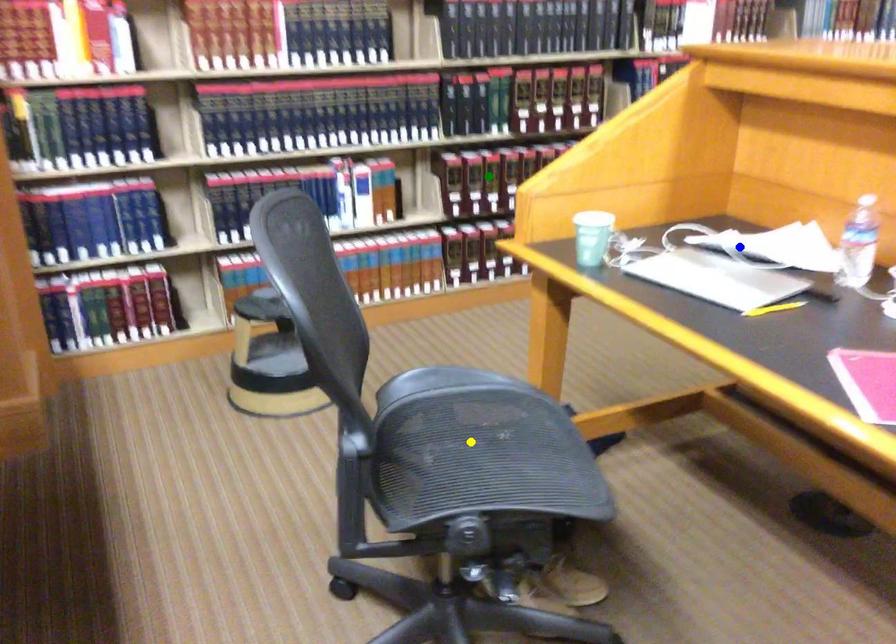
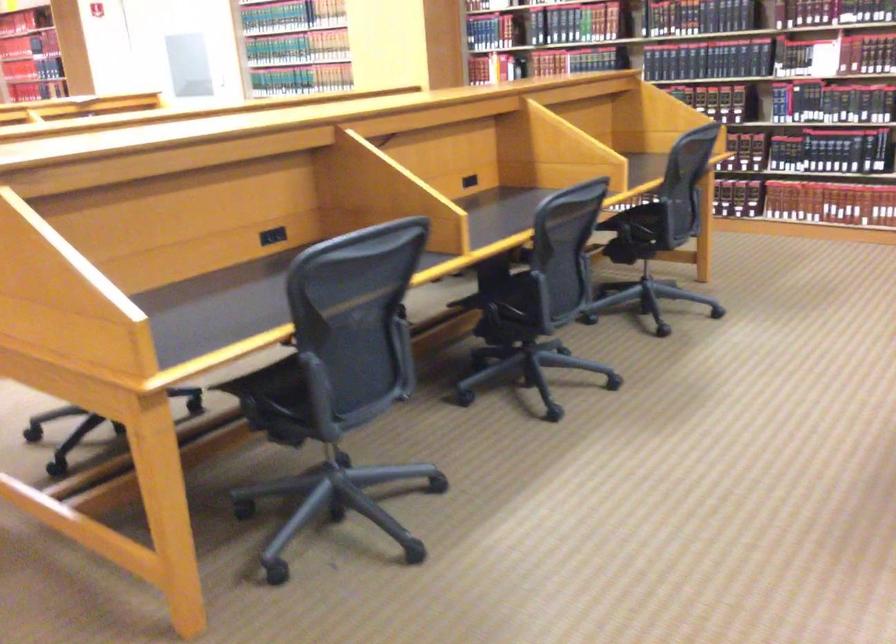
I am providing you with two images of the same scene from different viewpoints. Three points are marked in image1. Which point corresponds to a part or object that is occluded in image2?In image1, three points are marked. Which of them correspond to a part or object that is occluded in image2?Among the three points shown in image1, which one corresponds to a part or object that is no longer visible due to occlusion in image2?

yellow point, green point, blue point